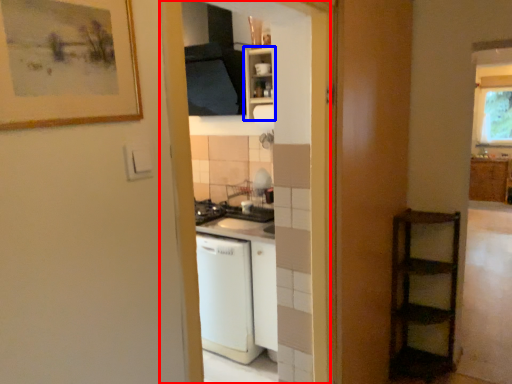
Question: Which object is further to the camera taking this photo, screen door (highlighted by a red box) or cabinetry (highlighted by a blue box)?

Choices:
 (A) screen door
 (B) cabinetry

Answer: (B)